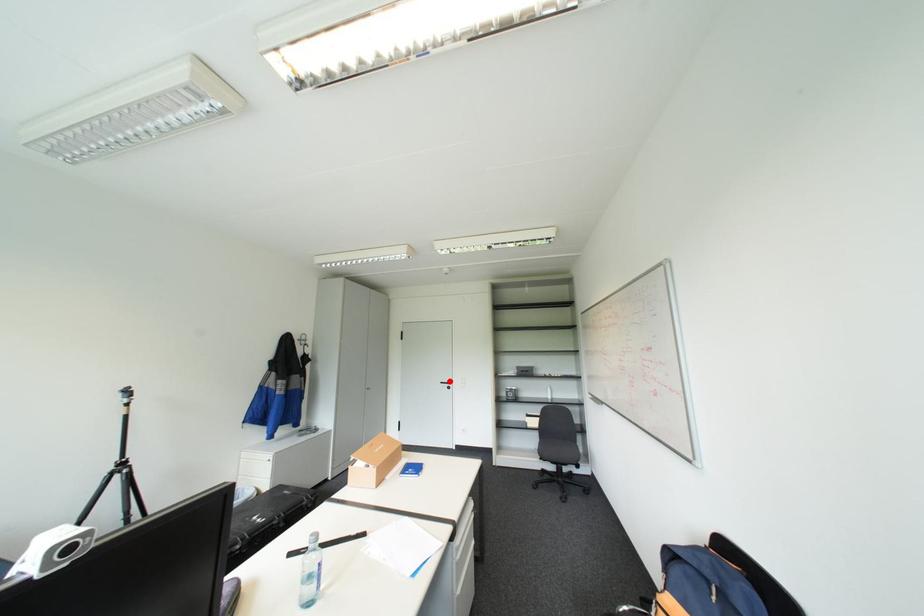
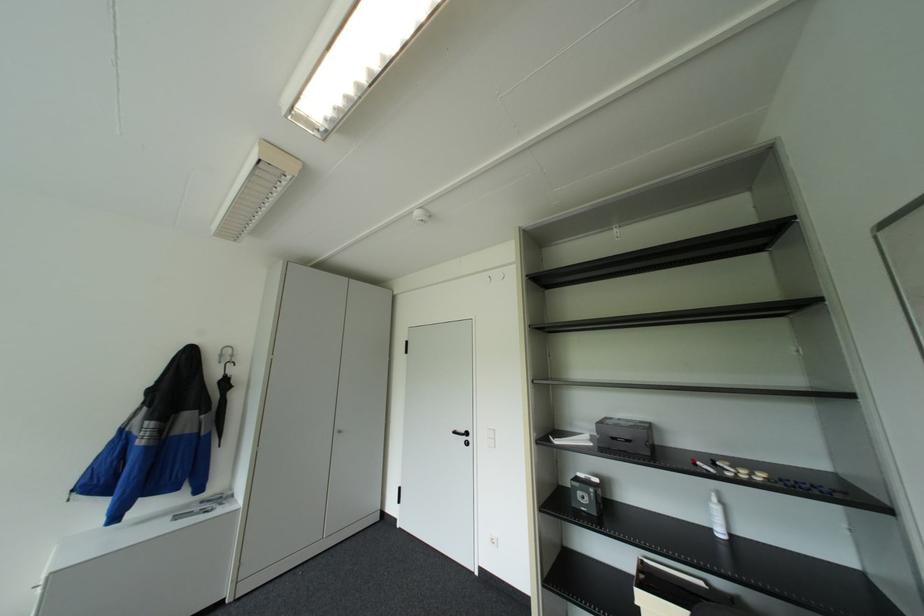
Locate, in the second image, the point that corresponds to the highlighted location in the first image.

(463, 431)